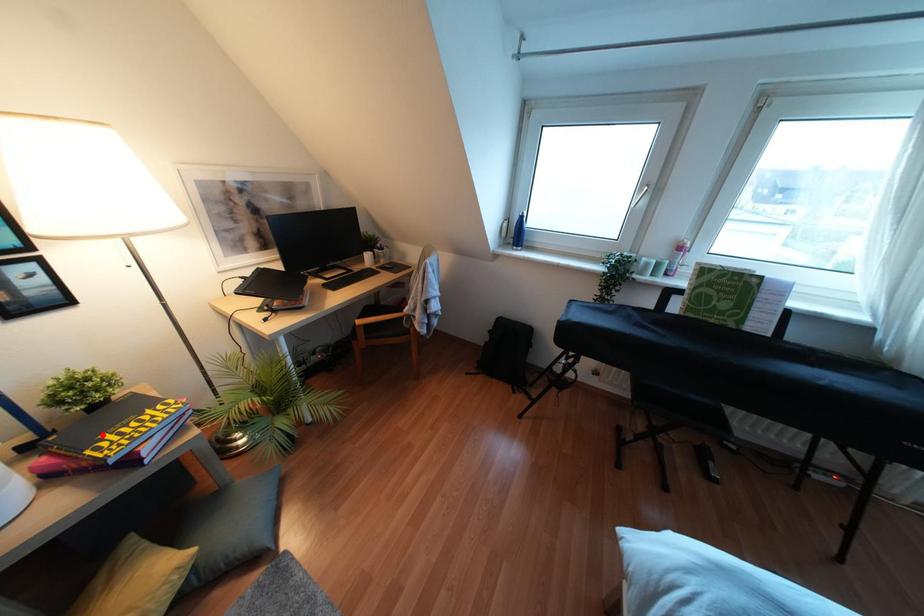
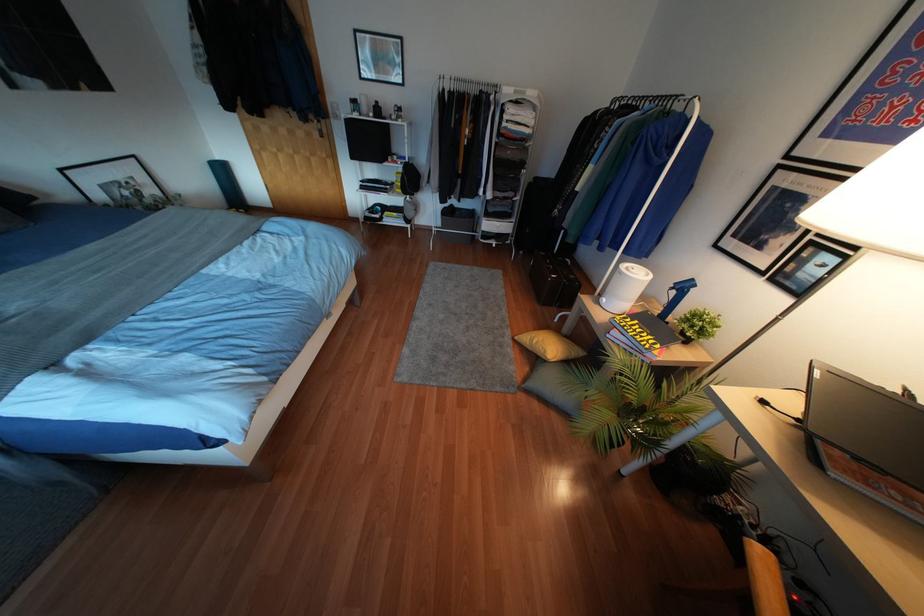
Locate, in the second image, the point that corresponds to the highlighted location in the first image.

(637, 321)